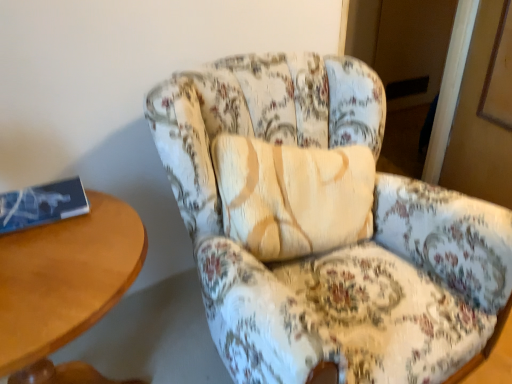
This screenshot has height=384, width=512. In order to click on free space above blue paper book at left (from a real-world perspective) in this screenshot , I will do `click(34, 196)`.